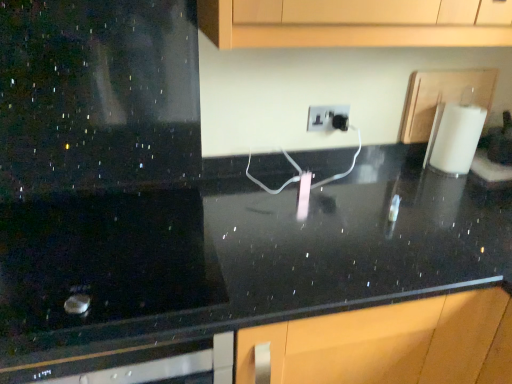
The height and width of the screenshot is (384, 512). I want to click on blank space to the left of white matte paper towel at right, so click(402, 172).